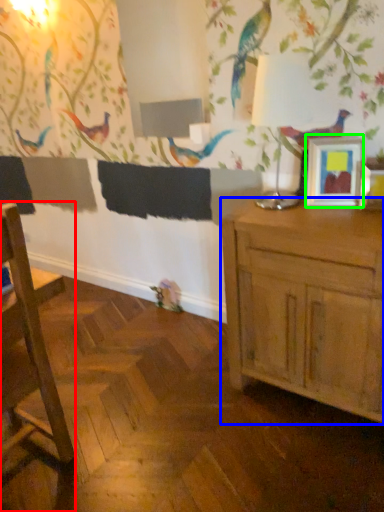
Question: Which object is the farthest from chair (highlighted by a red box)? Choose among these: cabinetry (highlighted by a blue box) or picture frame (highlighted by a green box).

Choices:
 (A) cabinetry
 (B) picture frame

Answer: (B)